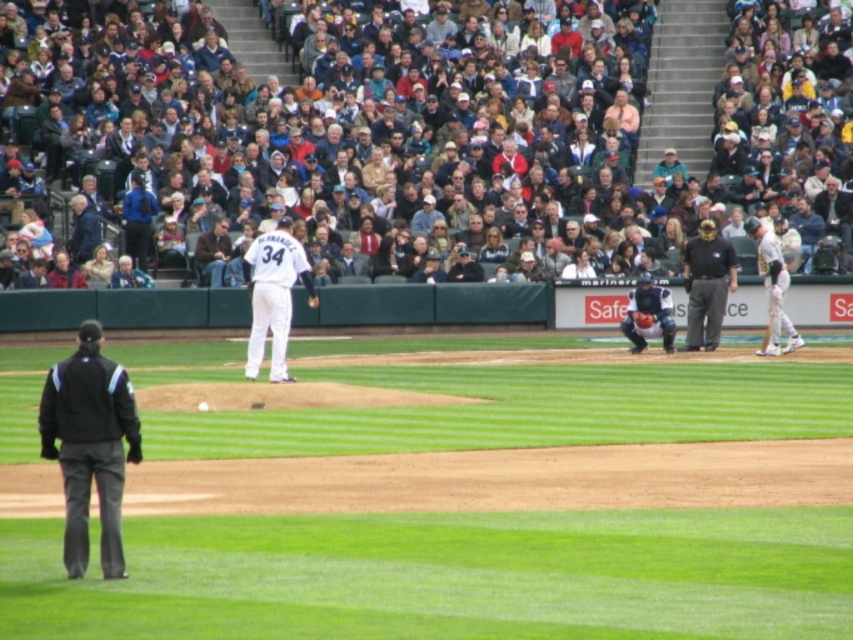
Is black shirt at center thinner than brown leather glove at lower center?

No.

From the picture: Who is shorter, black shirt at center or brown leather glove at lower center?

Standing shorter between the two is brown leather glove at lower center.

Who is more forward, (706, 310) or (648, 323)?

Positioned in front is point (648, 323).

Where is `black shirt at center`? This screenshot has width=853, height=640. black shirt at center is located at coordinates (706, 284).

Between white cotton crowd at upper center and white matte uniform at center, which one is positioned lower?

Positioned lower is white matte uniform at center.

Describe the element at coordinates (436, 113) in the screenshot. I see `white cotton crowd at upper center` at that location.

You are a GUI agent. You are given a task and a screenshot of the screen. Output one action in this format:
    pyautogui.click(x=<x>, y=<y>)
    Task: Click on the white cotton crowd at upper center
    This screenshot has height=640, width=853.
    Given the screenshot: What is the action you would take?
    pyautogui.click(x=436, y=113)

Is white cotton crowd at upper center further to camera compared to black fabric jacket at lower left?

Yes, white cotton crowd at upper center is behind black fabric jacket at lower left.

Identify the location of white cotton crowd at upper center. The height and width of the screenshot is (640, 853). (436, 113).

At what (x,y) coordinates should I click in order to perform the action: click on white cotton crowd at upper center. Please return your answer as a coordinate pair (x, y). Image resolution: width=853 pixels, height=640 pixels. Looking at the image, I should click on (436, 113).